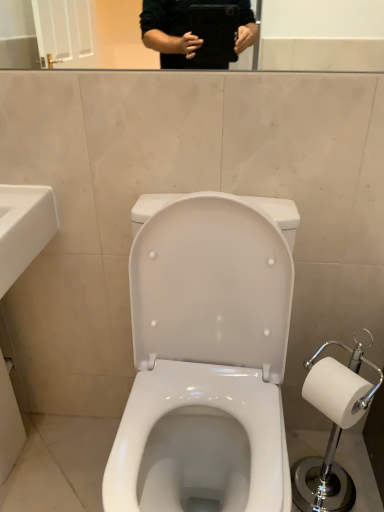
Question: Is white ceramic sink at lower left directly adjacent to white glossy toilet at center?

Choices:
 (A) no
 (B) yes

Answer: (A)

Question: Is white glossy toilet at center a part of white ceramic sink at lower left?

Choices:
 (A) no
 (B) yes

Answer: (A)

Question: Can you confirm if white ceramic sink at lower left is wider than white glossy toilet at center?

Choices:
 (A) no
 (B) yes

Answer: (A)

Question: Considering the relative sizes of white ceramic sink at lower left and white glossy toilet at center in the image provided, is white ceramic sink at lower left taller than white glossy toilet at center?

Choices:
 (A) no
 (B) yes

Answer: (B)

Question: Would you say white ceramic sink at lower left is a long distance from white glossy toilet at center?

Choices:
 (A) yes
 (B) no

Answer: (B)

Question: Considering the relative positions of white plastic toilet paper holder at right and white glossy toilet at center in the image provided, is white plastic toilet paper holder at right to the left or to the right of white glossy toilet at center?

Choices:
 (A) right
 (B) left

Answer: (A)

Question: From a real-world perspective, is white plastic toilet paper holder at right positioned above or below white glossy toilet at center?

Choices:
 (A) below
 (B) above

Answer: (B)

Question: Considering the positions of white plastic toilet paper holder at right and white glossy toilet at center in the image, is white plastic toilet paper holder at right taller or shorter than white glossy toilet at center?

Choices:
 (A) short
 (B) tall

Answer: (A)

Question: From the image's perspective, is white plastic toilet paper holder at right located above or below white glossy toilet at center?

Choices:
 (A) below
 (B) above

Answer: (B)

Question: Is white plastic toilet paper holder at right bigger or smaller than white ceramic sink at lower left?

Choices:
 (A) big
 (B) small

Answer: (B)

Question: Is white plastic toilet paper holder at right in front of or behind white ceramic sink at lower left in the image?

Choices:
 (A) front
 (B) behind

Answer: (B)

Question: Is white plastic toilet paper holder at right wider or thinner than white ceramic sink at lower left?

Choices:
 (A) wide
 (B) thin

Answer: (B)

Question: From a real-world perspective, is white plastic toilet paper holder at right physically located above or below white ceramic sink at lower left?

Choices:
 (A) above
 (B) below

Answer: (B)

Question: Is white ceramic sink at lower left bigger or smaller than white plastic toilet paper holder at right?

Choices:
 (A) big
 (B) small

Answer: (A)

Question: From the image's perspective, relative to white plastic toilet paper holder at right, is white ceramic sink at lower left above or below?

Choices:
 (A) above
 (B) below

Answer: (A)